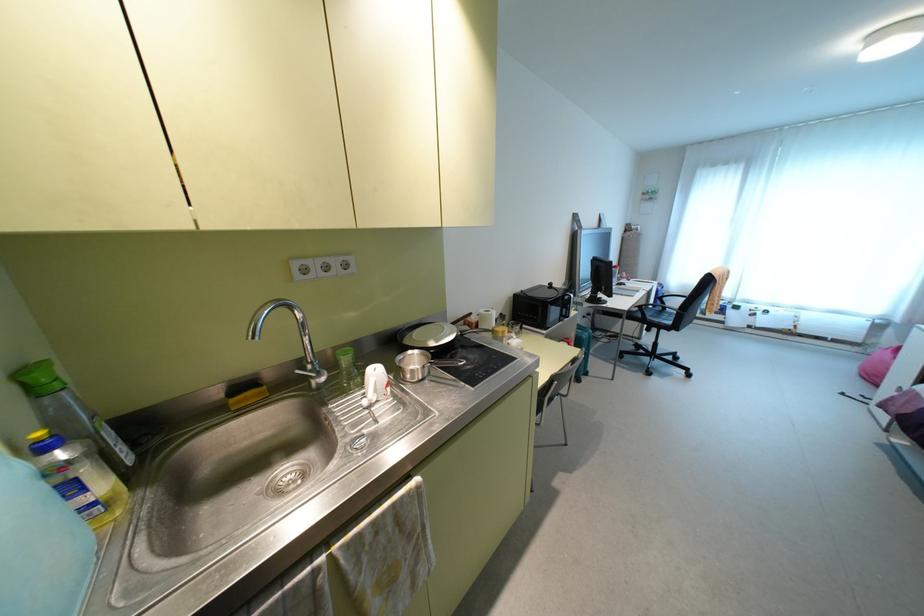
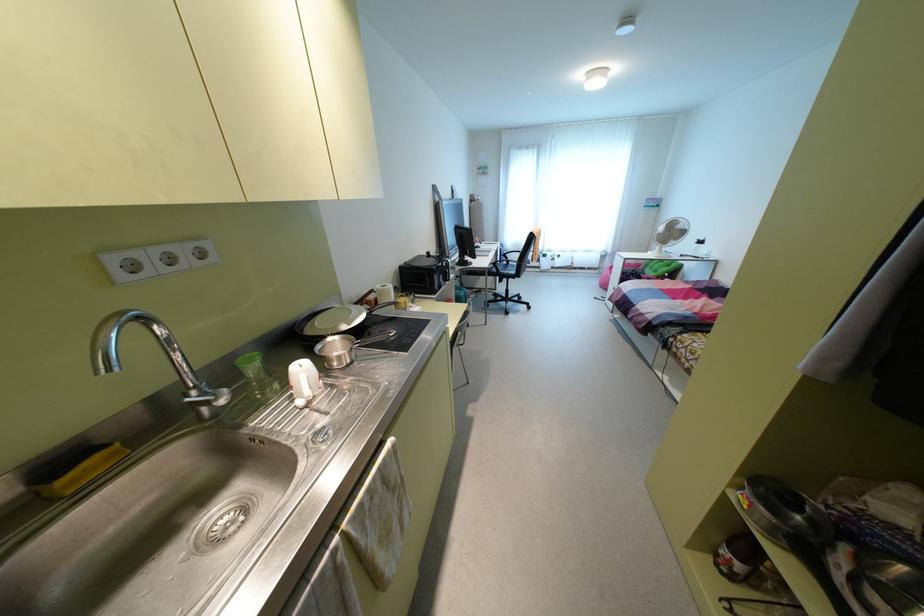
Find the pixel in the second image that matches (310,362) in the first image.

(195, 387)